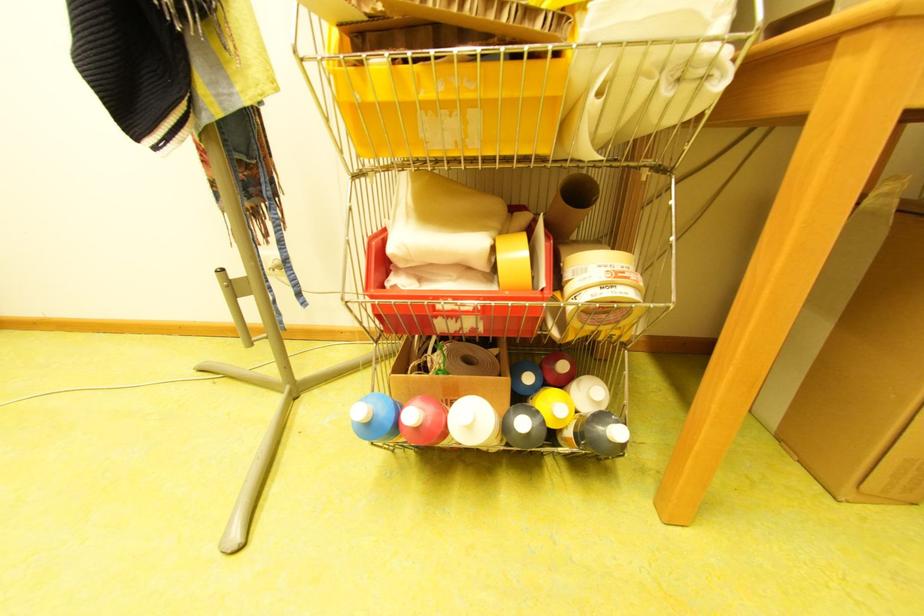
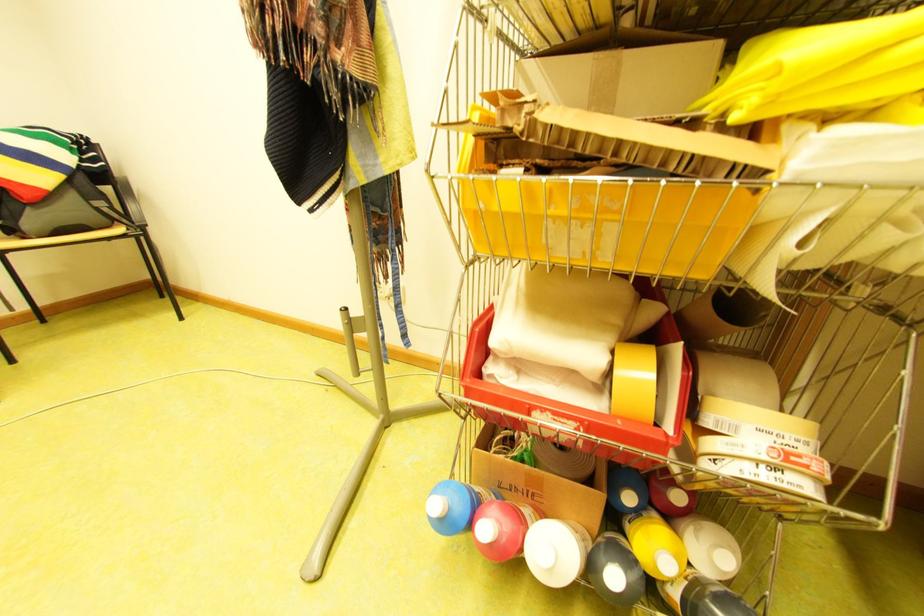
In the second image, find the point that corresponds to the point at 444,411 in the first image.

(518, 525)